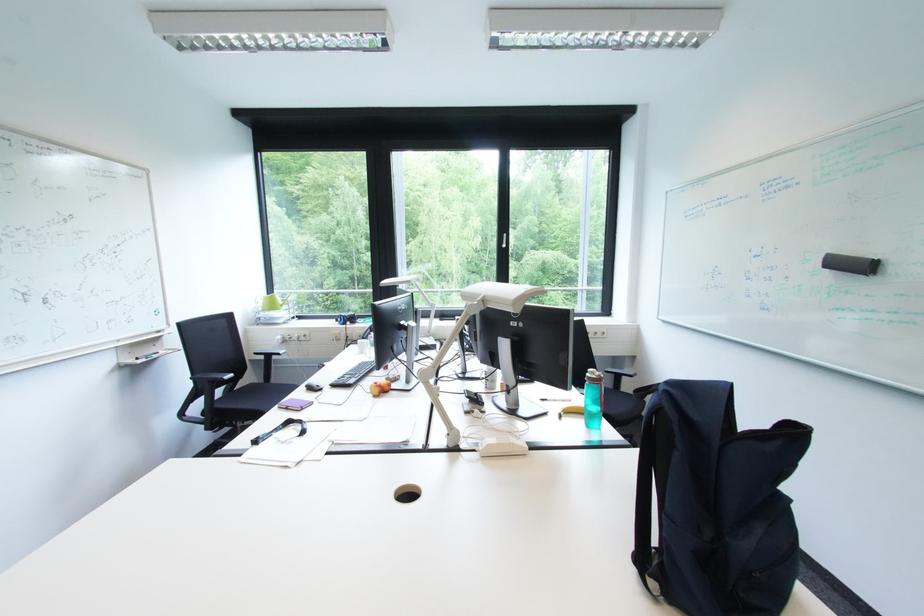
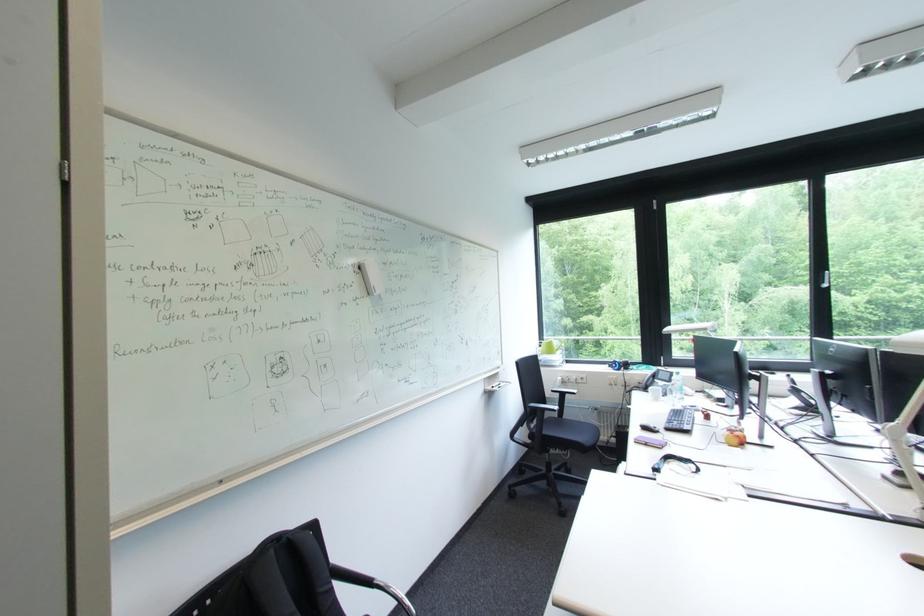
Find the pixel in the second image that matches [315,390] in the first image.

(650, 430)